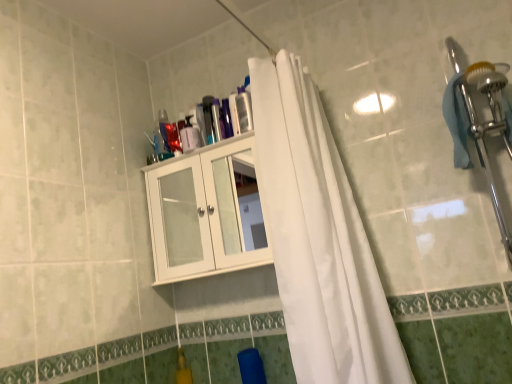
Question: Is point coord(364,372) closer or farther from the camera than point coord(208,216)?

Choices:
 (A) closer
 (B) farther

Answer: (A)

Question: From a real-world perspective, is white fabric curtain at center positioned above or below white glossy cabinet at upper center?

Choices:
 (A) below
 (B) above

Answer: (A)

Question: Which object is the farthest from the white glossy cabinet at upper center?

Choices:
 (A) white fabric curtain at center
 (B) transparent plastic bottle at upper center

Answer: (B)

Question: Estimate the real-world distances between objects in this image. Which object is closer to the transparent plastic bottle at upper center?

Choices:
 (A) white glossy cabinet at upper center
 (B) white fabric curtain at center

Answer: (A)